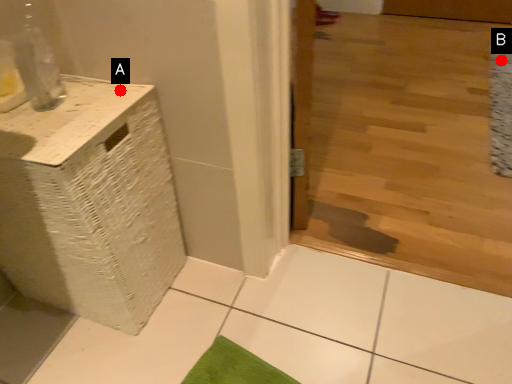
Question: Two points are circled on the image, labeled by A and B beside each circle. Which point appears farthest from the camera in this image?

Choices:
 (A) A is further
 (B) B is further

Answer: (B)